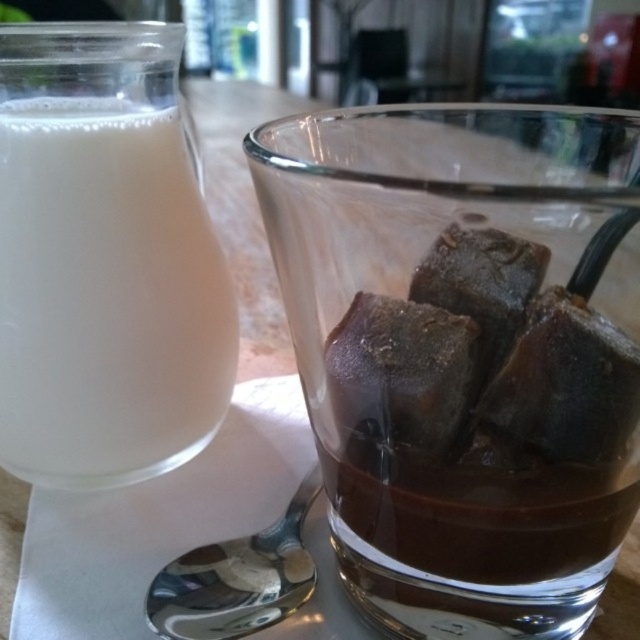
You are setting up a dessert table and need to arrange the dark chocolate cube at center and the satin silver spoon at lower center. According to the scene, which object is positioned to the right of the other?

The dark chocolate cube at center is positioned to the right of the satin silver spoon at lower center.

You are a bartender preparing a drink and need to know which object has a greater width between the white opaque liquid at left and the dark chocolate cube at center. Can you determine which one is wider?

The white opaque liquid at left has a larger width than the dark chocolate cube at center according to the description provided.

You are a barista trying to locate the white opaque liquid at left on the table. According to the coordinate system where the bottom left corner is the origin, can you determine its position?

The white opaque liquid at left is located at coordinates point (106, 300).